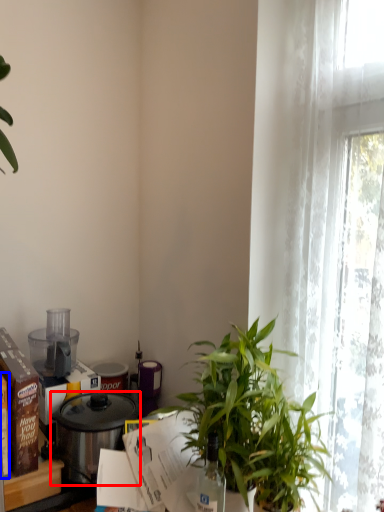
Question: Which of the following is the farthest to the observer, pot/pan (highlighted by a red box) or box (highlighted by a blue box)?

Choices:
 (A) pot/pan
 (B) box

Answer: (A)